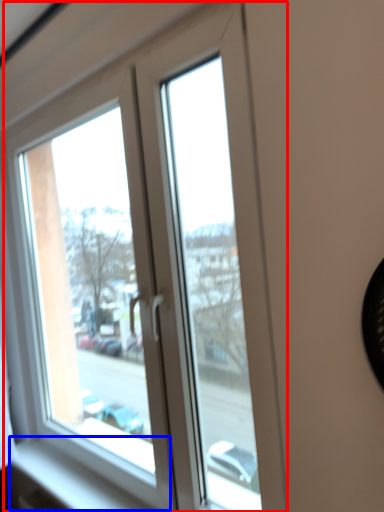
Question: Which object is further to the camera taking this photo, window (highlighted by a red box) or window sill (highlighted by a blue box)?

Choices:
 (A) window
 (B) window sill

Answer: (B)